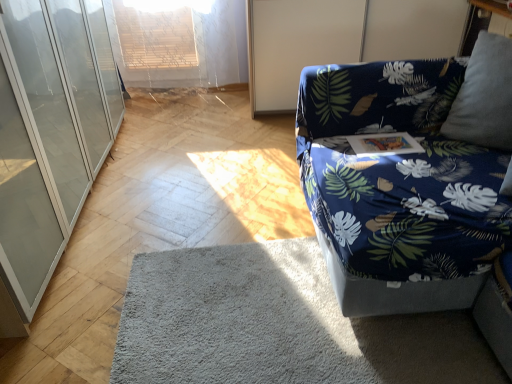
Question: Is blue fabric screen door at upper right inside the boundaries of transparent glass cabinet at left, or outside?

Choices:
 (A) inside
 (B) outside

Answer: (B)

Question: Would you say blue fabric screen door at upper right is to the left or to the right of transparent glass cabinet at left in the picture?

Choices:
 (A) right
 (B) left

Answer: (A)

Question: Based on their relative distances, which object is nearer to the blue fabric couch at right?

Choices:
 (A) blue fabric screen door at upper right
 (B) transparent glass cabinet at left
 (C) gray soft rug at lower center

Answer: (C)

Question: Based on their relative distances, which object is nearer to the gray soft rug at lower center?

Choices:
 (A) blue fabric screen door at upper right
 (B) blue fabric couch at right
 (C) transparent glass cabinet at left

Answer: (B)